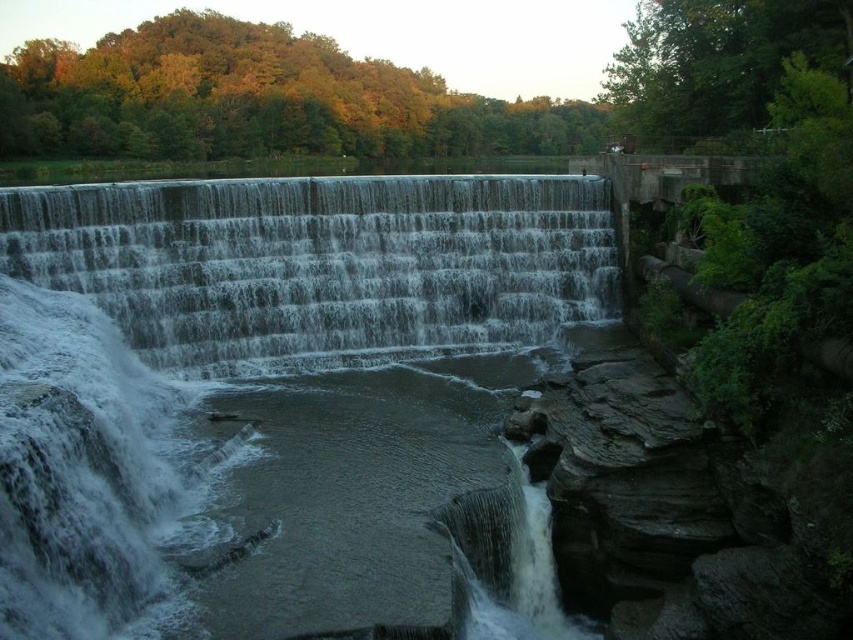
Does clear water at center have a lesser height compared to gray concrete waterfall at center?

In fact, clear water at center may be taller than gray concrete waterfall at center.

Looking at this image, who is higher up, clear water at center or gray concrete waterfall at center?

gray concrete waterfall at center is higher up.

Identify the location of clear water at center. The height and width of the screenshot is (640, 853). (277, 397).

The image size is (853, 640). In order to click on clear water at center in this screenshot , I will do `click(277, 397)`.